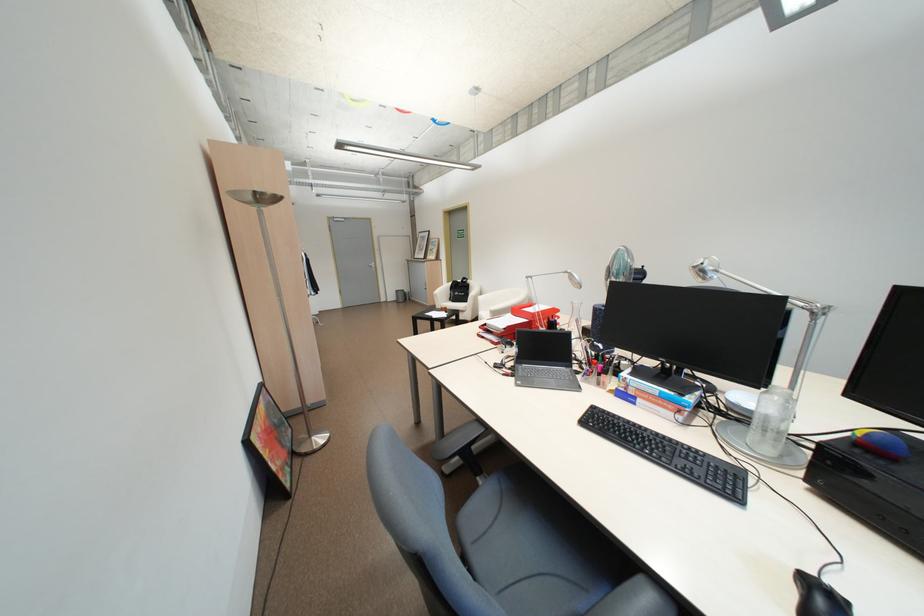
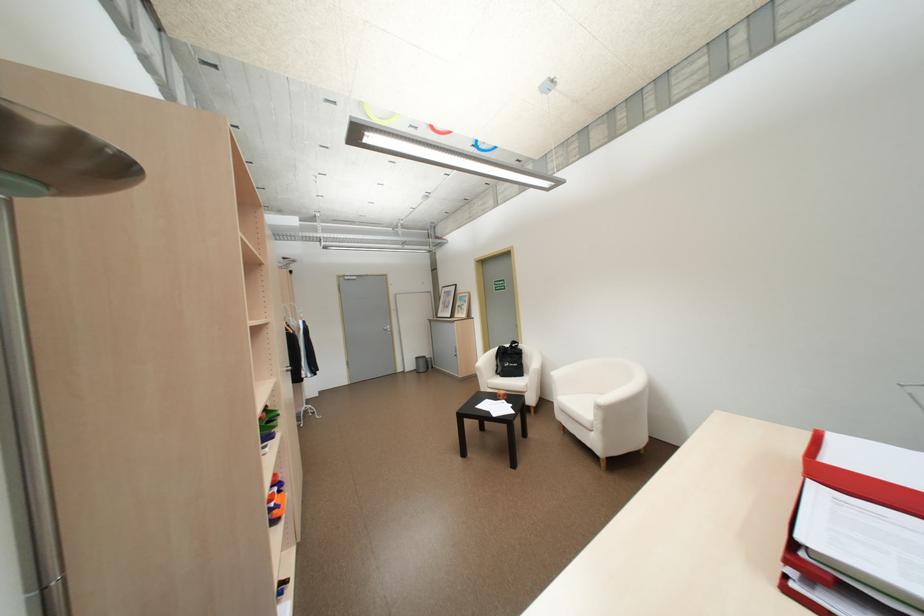
Which direction would the cameraman need to move to produce the second image?

The cameraman walked toward left, forward.